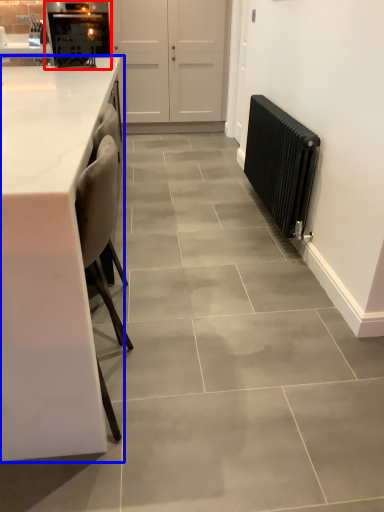
Question: Which of the following is the farthest to the observer, appliance (highlighted by a red box) or countertop (highlighted by a blue box)?

Choices:
 (A) appliance
 (B) countertop

Answer: (A)